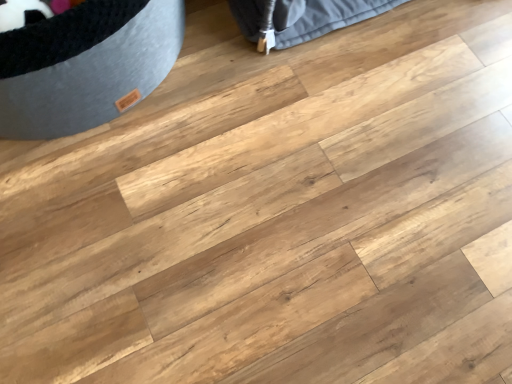
Image resolution: width=512 pixels, height=384 pixels. Describe the element at coordinates (85, 65) in the screenshot. I see `gray fabric pet bed at upper left` at that location.

I want to click on gray fabric pet bed at upper left, so click(85, 65).

What is the approximate height of gray fabric pet bed at upper left?

It is 25.73 centimeters.

Where is `gray fabric pet bed at upper left`? This screenshot has width=512, height=384. gray fabric pet bed at upper left is located at coordinates (85, 65).